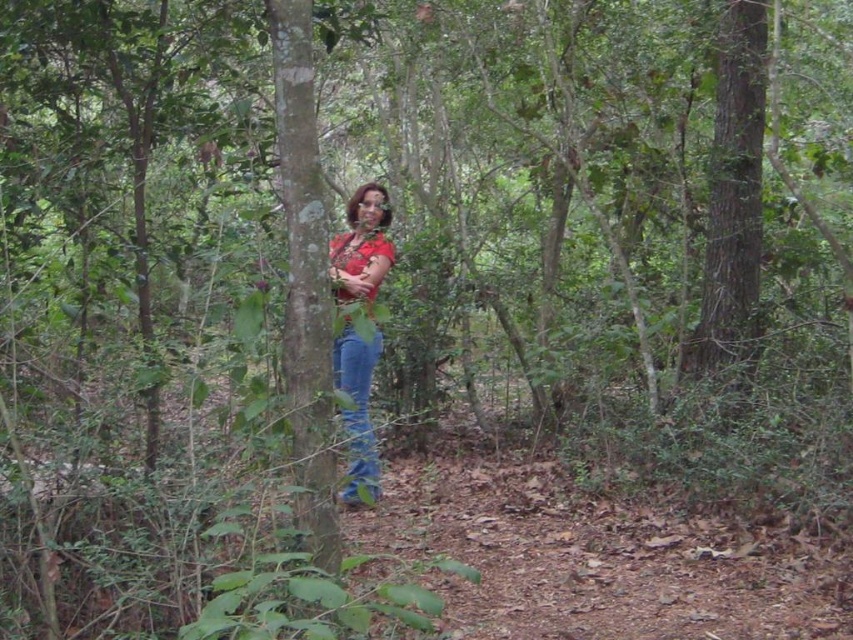
You are navigating through the wooded area shown in the image. You see two points marked as point (299, 264) and point (750, 243). Which point is closer to you?

Point (299, 264) is in front of point (750, 243), so it is closer to you.

You are a hiker trying to identify two trees in the forest. You see a smooth bark tree trunk at center and a brown rough tree trunk at right. Which tree is located to the left of the other?

The smooth bark tree trunk at center is positioned on the left side of brown rough tree trunk at right, so the smooth bark tree trunk at center is to the left of the brown rough tree trunk at right.

You are an outdoor photographer trying to capture the smooth bark tree trunk at center and the matte red shirt at center in your shot. Which object is narrower in the scene?

The smooth bark tree trunk at center is narrower than the matte red shirt at center.